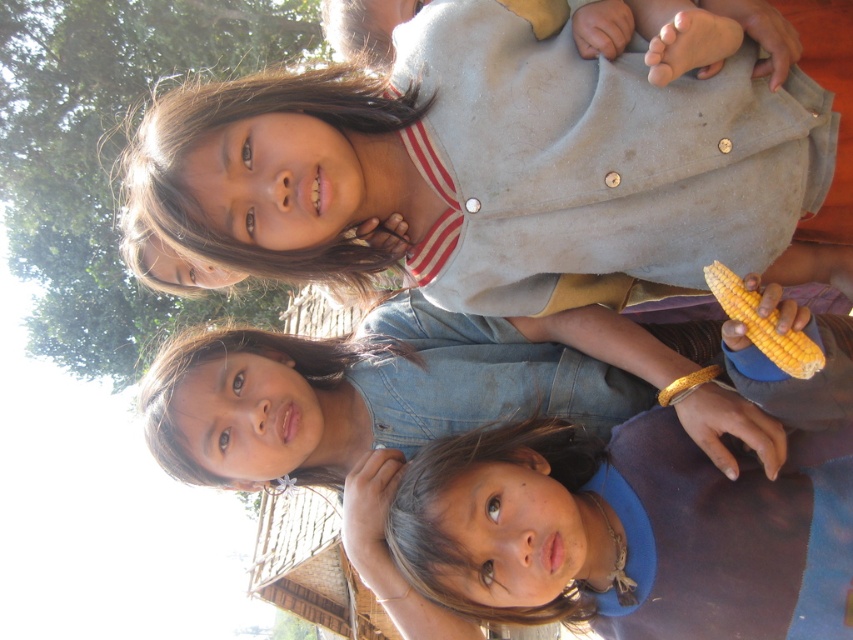
Question: Among these points, which one is farthest from the camera?

Choices:
 (A) (781, 342)
 (B) (463, 3)

Answer: (B)

Question: Does matte gray shirt at upper center come in front of yellow matte corn at right?

Choices:
 (A) yes
 (B) no

Answer: (B)

Question: Where is matte gray shirt at upper center located in relation to yellow matte corn at right in the image?

Choices:
 (A) right
 (B) left

Answer: (B)

Question: Which of the following is the farthest from the observer?

Choices:
 (A) yellow matte corn at right
 (B) matte gray shirt at upper center

Answer: (B)

Question: Is matte gray shirt at upper center below yellow matte corn at right?

Choices:
 (A) yes
 (B) no

Answer: (B)